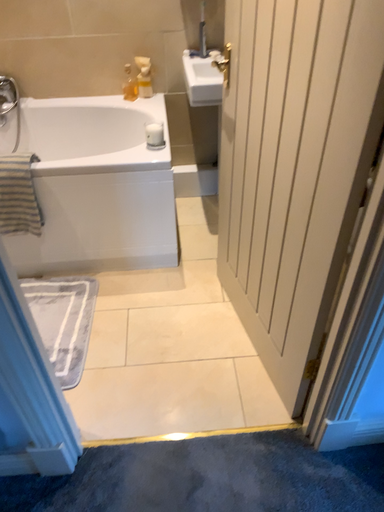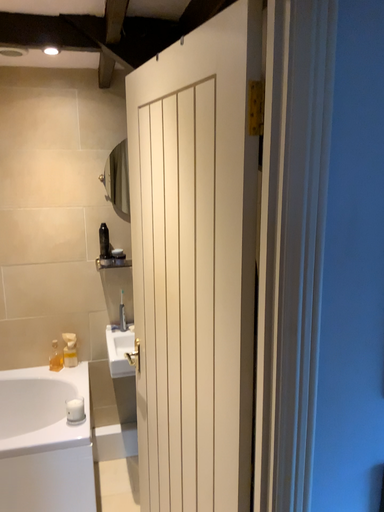
Question: How did the camera likely rotate when shooting the video?

Choices:
 (A) rotated left
 (B) rotated right

Answer: (B)